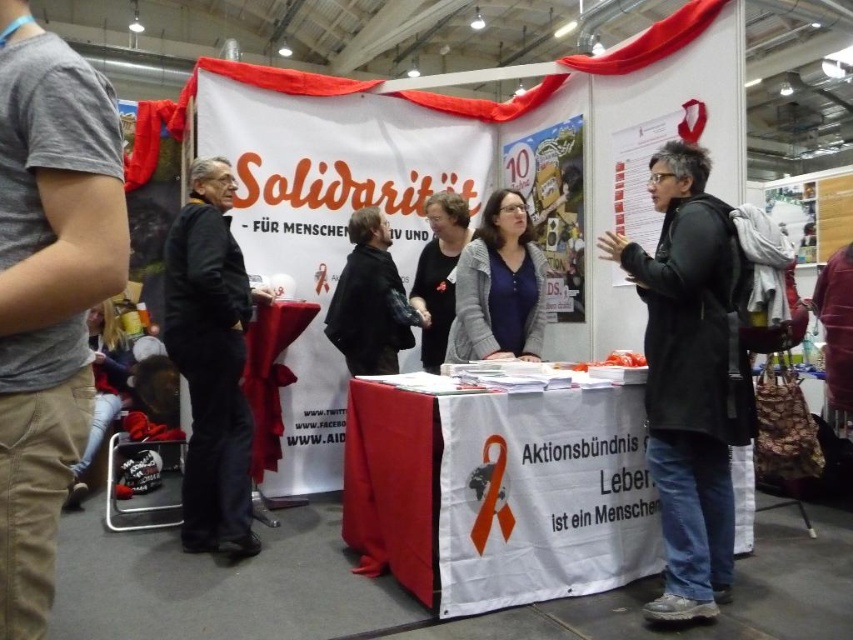
You are attending a charity event and want to locate two specific points marked on the booth. The first point is at coordinates point [703,512] and the second is at point [412,307]. From your vantage point at the entrance, which point is closer to you?

Point [703,512] is in front of point [412,307], so it is closer to you.

What is the spatial relationship between the black matte coat at center and the dark gray sweater at center in terms of height?

The black matte coat at center is much taller than the dark gray sweater at center.